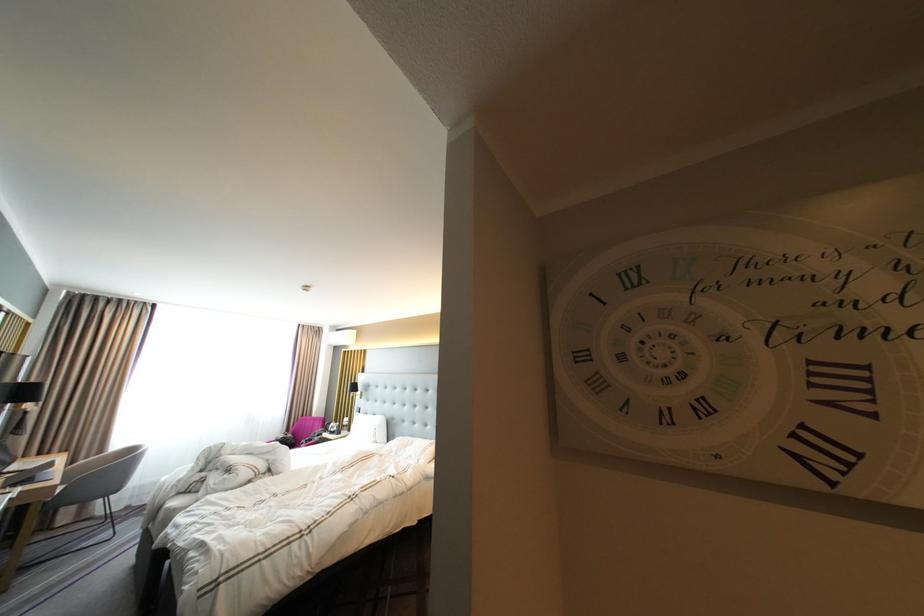
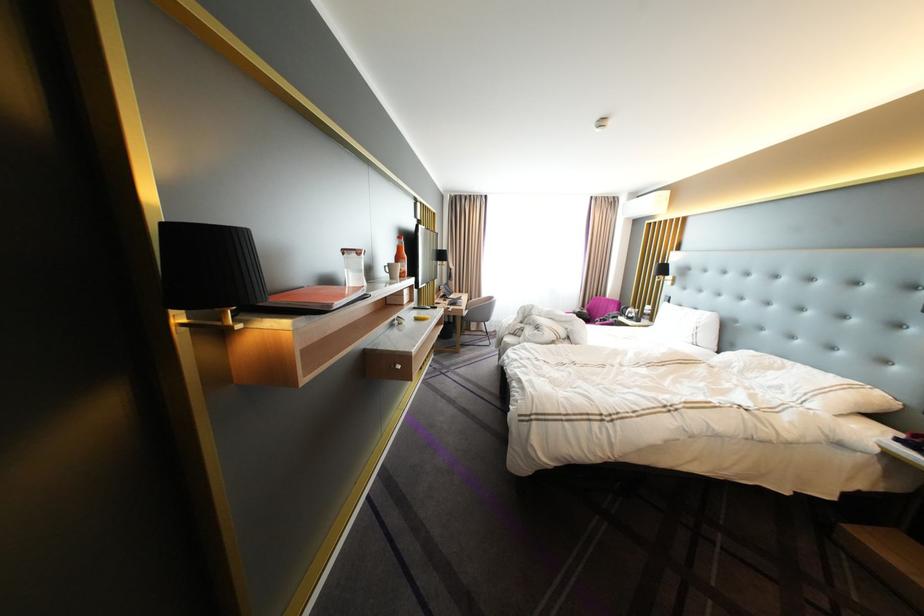
In the second image, find the point that corresponds to [330,424] in the first image.

(625, 307)